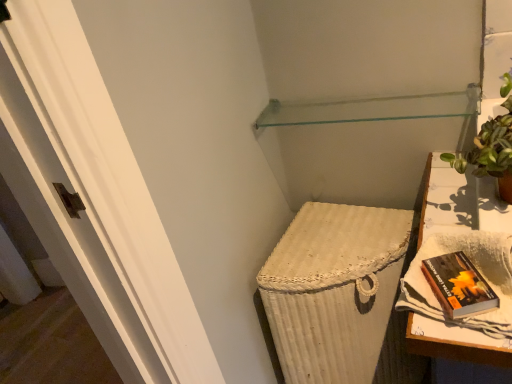
In order to click on transparent glass shelf at upper center in this screenshot , I will do 371,109.

Is hardcover book at right facing away from green leafy plant in terracotta pot at upper right?

hardcover book at right does not have its back to green leafy plant in terracotta pot at upper right.

Can you confirm if hardcover book at right is wider than green leafy plant in terracotta pot at upper right?

Incorrect, the width of hardcover book at right does not surpass that of green leafy plant in terracotta pot at upper right.

How different are the orientations of hardcover book at right and green leafy plant in terracotta pot at upper right in degrees?

The facing directions of hardcover book at right and green leafy plant in terracotta pot at upper right are 26.1 degrees apart.

Is hardcover book at right not near green leafy plant in terracotta pot at upper right?

No, hardcover book at right is in close proximity to green leafy plant in terracotta pot at upper right.

From a real-world perspective, who is located higher, white woven table at right or green leafy plant in terracotta pot at upper right?

green leafy plant in terracotta pot at upper right is physically above.

Are white woven table at right and green leafy plant in terracotta pot at upper right making contact?

No, white woven table at right is not with green leafy plant in terracotta pot at upper right.

Considering their positions, is white woven table at right located in front of or behind green leafy plant in terracotta pot at upper right?

In the image, white woven table at right appears in front of green leafy plant in terracotta pot at upper right.

Choose the correct answer: Is white woven table at right inside green leafy plant in terracotta pot at upper right or outside it?

white woven table at right is outside green leafy plant in terracotta pot at upper right.

From a real-world perspective, is transparent glass shelf at upper center physically above white woven table at right?

Yes, from a real-world perspective, transparent glass shelf at upper center is over white woven table at right

Which object is further away from the camera taking this photo, transparent glass shelf at upper center or white woven table at right?

transparent glass shelf at upper center is further from the camera.

Is transparent glass shelf at upper center positioned beyond the bounds of white woven table at right?

Yes, transparent glass shelf at upper center is not within white woven table at right.

Is hardcover book at right touching white woven table at right?

No, hardcover book at right is not touching white woven table at right.

Which is correct: hardcover book at right is inside white woven table at right, or outside of it?

hardcover book at right is located inside white woven table at right.

Which object is closer to the camera taking this photo, hardcover book at right or white woven table at right?

white woven table at right is in front.

From the image's perspective, is hardcover book at right located above white woven table at right?

Incorrect, from the image's perspective, hardcover book at right is lower than white woven table at right.

Can you confirm if white woven table at right is bigger than hardcover book at right?

Yes, white woven table at right is bigger than hardcover book at right.

From the image's perspective, does white woven table at right appear higher than hardcover book at right?

Indeed, from the image's perspective, white woven table at right is shown above hardcover book at right.

Is white woven table at right not near hardcover book at right?

Actually, white woven table at right and hardcover book at right are a little close together.

The image size is (512, 384). Identify the location of shelf lying above the white woven table at right (from the image's perspective). (371, 109).

From the image's perspective, is white woven table at right under transparent glass shelf at upper center?

Yes, from the image's perspective, white woven table at right is beneath transparent glass shelf at upper center.

Considering the relative sizes of white woven table at right and transparent glass shelf at upper center in the image provided, is white woven table at right bigger than transparent glass shelf at upper center?

Correct, white woven table at right is larger in size than transparent glass shelf at upper center.

Between white woven table at right and transparent glass shelf at upper center, which one is positioned in front?

white woven table at right is more forward.

Does green leafy plant in terracotta pot at upper right have a smaller size compared to hardcover book at right?

Actually, green leafy plant in terracotta pot at upper right might be larger than hardcover book at right.

From the picture: From a real-world perspective, is green leafy plant in terracotta pot at upper right below hardcover book at right?

No, from a real-world perspective, green leafy plant in terracotta pot at upper right is not beneath hardcover book at right.

From the picture: Which of these two, green leafy plant in terracotta pot at upper right or hardcover book at right, is wider?

green leafy plant in terracotta pot at upper right is wider.

The height and width of the screenshot is (384, 512). Find the location of `houseplant located on the right of hardcover book at right`. houseplant located on the right of hardcover book at right is located at coordinates (490, 148).

The image size is (512, 384). I want to click on table to the left of green leafy plant in terracotta pot at upper right, so click(x=459, y=353).

Which object lies nearer to the anchor point transparent glass shelf at upper center, green leafy plant in terracotta pot at upper right or white woven table at right?

green leafy plant in terracotta pot at upper right lies closer to transparent glass shelf at upper center than the other object.

Estimate the real-world distances between objects in this image. Which object is further from white woven table at right, transparent glass shelf at upper center or green leafy plant in terracotta pot at upper right?

transparent glass shelf at upper center.

Considering their positions, is hardcover book at right positioned closer to white woven table at right than transparent glass shelf at upper center?

Based on the image, hardcover book at right appears to be nearer to white woven table at right.

From the image, which object appears to be nearer to green leafy plant in terracotta pot at upper right, transparent glass shelf at upper center or white woven table at right?

Among the two, white woven table at right is located nearer to green leafy plant in terracotta pot at upper right.

Looking at the image, which one is located further to green leafy plant in terracotta pot at upper right, hardcover book at right or transparent glass shelf at upper center?

Based on the image, transparent glass shelf at upper center appears to be further to green leafy plant in terracotta pot at upper right.

Considering their positions, is green leafy plant in terracotta pot at upper right positioned closer to hardcover book at right than transparent glass shelf at upper center?

Among the two, green leafy plant in terracotta pot at upper right is located nearer to hardcover book at right.

Looking at the image, which one is located closer to transparent glass shelf at upper center, green leafy plant in terracotta pot at upper right or hardcover book at right?

green leafy plant in terracotta pot at upper right lies closer to transparent glass shelf at upper center than the other object.

Consider the image. Estimate the real-world distances between objects in this image. Which object is closer to green leafy plant in terracotta pot at upper right, transparent glass shelf at upper center or hardcover book at right?

hardcover book at right.

Identify the location of table between green leafy plant in terracotta pot at upper right and hardcover book at right in the vertical direction. The image size is (512, 384). (459, 353).

This screenshot has height=384, width=512. Identify the location of houseplant between transparent glass shelf at upper center and hardcover book at right in the up-down direction. (490, 148).

Where is `table between transparent glass shelf at upper center and hardcover book at right in the vertical direction`? This screenshot has width=512, height=384. table between transparent glass shelf at upper center and hardcover book at right in the vertical direction is located at coordinates (459, 353).

This screenshot has height=384, width=512. I want to click on houseplant positioned between white woven table at right and transparent glass shelf at upper center from near to far, so coord(490,148).